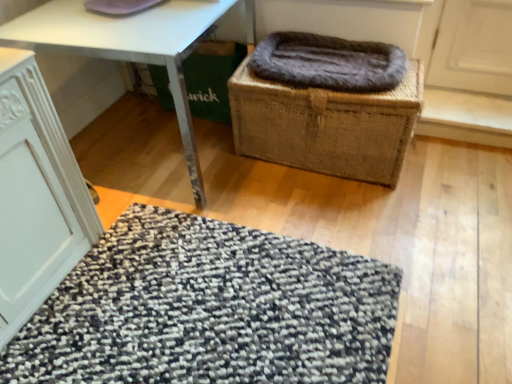
Describe the element at coordinates (326, 125) in the screenshot. I see `woven brown basket at center` at that location.

This screenshot has width=512, height=384. What do you see at coordinates (36, 195) in the screenshot?
I see `white matte cabinet at lower left` at bounding box center [36, 195].

The width and height of the screenshot is (512, 384). In order to click on white matte cabinet at lower left in this screenshot , I will do `click(36, 195)`.

In order to click on fuzzy brown blanket at center in this screenshot , I will do `click(328, 62)`.

I want to click on woven brown basket at center, so click(x=326, y=125).

What are the coordinates of `blanket above the textured gray mat at lower center (from a real-world perspective)` in the screenshot? It's located at (328, 62).

Which object is positioned more to the left, fuzzy brown blanket at center or textured gray mat at lower center?

Positioned to the left is textured gray mat at lower center.

Does fuzzy brown blanket at center lie behind textured gray mat at lower center?

Yes, the depth of fuzzy brown blanket at center is greater than that of textured gray mat at lower center.

Between white matte cabinet at lower left and textured gray mat at lower center, which one has larger width?

Wider between the two is textured gray mat at lower center.

Is white matte cabinet at lower left outside of textured gray mat at lower center?

white matte cabinet at lower left lies outside textured gray mat at lower center's area.

From a real-world perspective, is white matte cabinet at lower left physically located above or below textured gray mat at lower center?

Clearly, from a real-world perspective, white matte cabinet at lower left is above textured gray mat at lower center.

Which object is positioned more to the right, white matte cabinet at lower left or woven brown basket at center?

woven brown basket at center is more to the right.

Locate an element on the screen. The width and height of the screenshot is (512, 384). cabinetry that appears below the woven brown basket at center (from the image's perspective) is located at coordinates (36, 195).

Is white matte cabinet at lower left smaller than woven brown basket at center?

No.

Does point (23, 142) come in front of point (395, 102)?

Yes, it is.

From a real-world perspective, between woven brown basket at center and white glossy table at center, who is vertically lower?

woven brown basket at center, from a real-world perspective.

Consider the image. Are woven brown basket at center and white glossy table at center far apart?

woven brown basket at center is actually quite close to white glossy table at center.

You are a GUI agent. You are given a task and a screenshot of the screen. Output one action in this format:
    pyautogui.click(x=<x>, y=<y>)
    Task: Click on the table on the left of woven brown basket at center
    The image size is (512, 384).
    Given the screenshot: What is the action you would take?
    pyautogui.click(x=127, y=47)

Is the depth of woven brown basket at center less than that of white glossy table at center?

No, it is not.

Can you confirm if white glossy table at center is positioned to the left of fuzzy brown blanket at center?

Correct, you'll find white glossy table at center to the left of fuzzy brown blanket at center.

From a real-world perspective, is white glossy table at center under fuzzy brown blanket at center?

Yes, from a real-world perspective, white glossy table at center is below fuzzy brown blanket at center.

Which of these two, white glossy table at center or fuzzy brown blanket at center, stands shorter?

Standing shorter between the two is fuzzy brown blanket at center.

From the image's perspective, which is above, textured gray mat at lower center or white glossy table at center?

From the image's view, white glossy table at center is above.

Is textured gray mat at lower center with white glossy table at center?

No, textured gray mat at lower center is not making contact with white glossy table at center.

Is textured gray mat at lower center turned away from white glossy table at center?

That's not correct — textured gray mat at lower center is not looking away from white glossy table at center.

Does point (240, 362) come farther from viewer compared to point (90, 52)?

No, it is not.

From a real-world perspective, is white matte cabinet at lower left below fuzzy brown blanket at center?

Yes, from a real-world perspective, white matte cabinet at lower left is under fuzzy brown blanket at center.

From the picture: Is white matte cabinet at lower left positioned far away from fuzzy brown blanket at center?

Yes, white matte cabinet at lower left is far from fuzzy brown blanket at center.

From the image's perspective, is white matte cabinet at lower left on fuzzy brown blanket at center?

Incorrect, from the image's perspective, white matte cabinet at lower left is lower than fuzzy brown blanket at center.

Considering their positions, is white matte cabinet at lower left located in front of or behind fuzzy brown blanket at center?

white matte cabinet at lower left is positioned closer to the viewer than fuzzy brown blanket at center.

At what (x,y) coordinates should I click in order to perform the action: click on mat that is in front of the fuzzy brown blanket at center. Please return your answer as a coordinate pair (x, y). Image resolution: width=512 pixels, height=384 pixels. Looking at the image, I should click on (209, 310).

At what (x,y) coordinates should I click in order to perform the action: click on cabinetry positioned vertically above the textured gray mat at lower center (from a real-world perspective). Please return your answer as a coordinate pair (x, y). This screenshot has width=512, height=384. Looking at the image, I should click on (36, 195).

Looking at the image, which one is located closer to white glossy table at center, textured gray mat at lower center or white matte cabinet at lower left?

white matte cabinet at lower left.

Based on their spatial positions, is white glossy table at center or woven brown basket at center closer to white matte cabinet at lower left?

Based on the image, white glossy table at center appears to be nearer to white matte cabinet at lower left.

Consider the image. Considering their positions, is fuzzy brown blanket at center positioned further to woven brown basket at center than textured gray mat at lower center?

Based on the image, textured gray mat at lower center appears to be further to woven brown basket at center.

Looking at the image, which one is located further to fuzzy brown blanket at center, white matte cabinet at lower left or woven brown basket at center?

white matte cabinet at lower left is further to fuzzy brown blanket at center.

Based on their spatial positions, is textured gray mat at lower center or woven brown basket at center further from white matte cabinet at lower left?

woven brown basket at center lies further to white matte cabinet at lower left than the other object.

Based on their spatial positions, is white glossy table at center or textured gray mat at lower center further from white matte cabinet at lower left?

white glossy table at center is positioned further to the anchor white matte cabinet at lower left.

Looking at the image, which one is located closer to woven brown basket at center, textured gray mat at lower center or fuzzy brown blanket at center?

fuzzy brown blanket at center lies closer to woven brown basket at center than the other object.

Estimate the real-world distances between objects in this image. Which object is further from fuzzy brown blanket at center, white matte cabinet at lower left or textured gray mat at lower center?

Based on the image, white matte cabinet at lower left appears to be further to fuzzy brown blanket at center.

You are a GUI agent. You are given a task and a screenshot of the screen. Output one action in this format:
    pyautogui.click(x=<x>, y=<y>)
    Task: Click on the blanket located between white matte cabinet at lower left and woven brown basket at center in the left-right direction
    
    Given the screenshot: What is the action you would take?
    pyautogui.click(x=328, y=62)

I want to click on basket between fuzzy brown blanket at center and textured gray mat at lower center in the up-down direction, so click(x=326, y=125).

The height and width of the screenshot is (384, 512). I want to click on table that lies between fuzzy brown blanket at center and textured gray mat at lower center from top to bottom, so click(x=127, y=47).

You are a GUI agent. You are given a task and a screenshot of the screen. Output one action in this format:
    pyautogui.click(x=<x>, y=<y>)
    Task: Click on the blanket located between white glossy table at center and woven brown basket at center in the left-right direction
    The width and height of the screenshot is (512, 384).
    Given the screenshot: What is the action you would take?
    click(x=328, y=62)